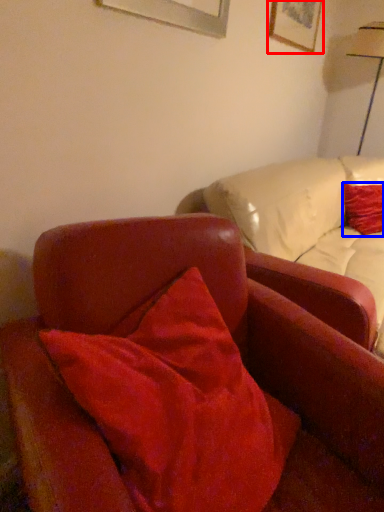
Question: Among these objects, which one is farthest to the camera, picture frame (highlighted by a red box) or pillow (highlighted by a blue box)?

Choices:
 (A) picture frame
 (B) pillow

Answer: (B)